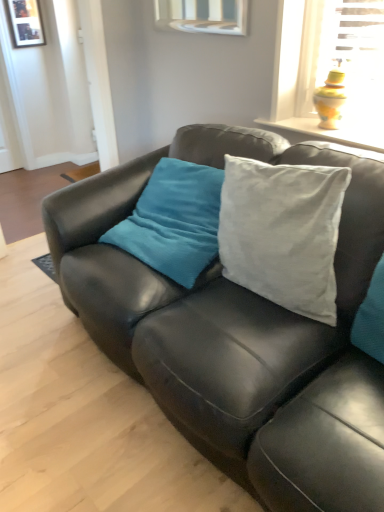
Question: Is wooden picture frame at upper left behind matte black couch at center?

Choices:
 (A) yes
 (B) no

Answer: (A)

Question: From a real-world perspective, is wooden picture frame at upper left physically above matte black couch at center?

Choices:
 (A) no
 (B) yes

Answer: (B)

Question: Is wooden picture frame at upper left positioned far away from matte black couch at center?

Choices:
 (A) yes
 (B) no

Answer: (A)

Question: Is wooden picture frame at upper left thinner than matte black couch at center?

Choices:
 (A) yes
 (B) no

Answer: (A)

Question: Does wooden picture frame at upper left have a greater width compared to matte black couch at center?

Choices:
 (A) yes
 (B) no

Answer: (B)

Question: Could you tell me if wooden picture frame at upper left is turned towards matte black couch at center?

Choices:
 (A) no
 (B) yes

Answer: (B)

Question: Does matte black couch at center have a lesser width compared to wooden picture frame at upper left?

Choices:
 (A) yes
 (B) no

Answer: (B)

Question: Does matte black couch at center appear on the left side of wooden picture frame at upper left?

Choices:
 (A) yes
 (B) no

Answer: (B)

Question: Would you consider matte black couch at center to be distant from wooden picture frame at upper left?

Choices:
 (A) no
 (B) yes

Answer: (B)

Question: Considering the relative sizes of matte black couch at center and wooden picture frame at upper left in the image provided, is matte black couch at center shorter than wooden picture frame at upper left?

Choices:
 (A) no
 (B) yes

Answer: (A)

Question: Is matte black couch at center aimed at wooden picture frame at upper left?

Choices:
 (A) yes
 (B) no

Answer: (B)

Question: Is matte black couch at center bigger than wooden picture frame at upper left?

Choices:
 (A) yes
 (B) no

Answer: (A)

Question: Is point (162, 334) positioned closer to the camera than point (29, 20)?

Choices:
 (A) closer
 (B) farther

Answer: (A)